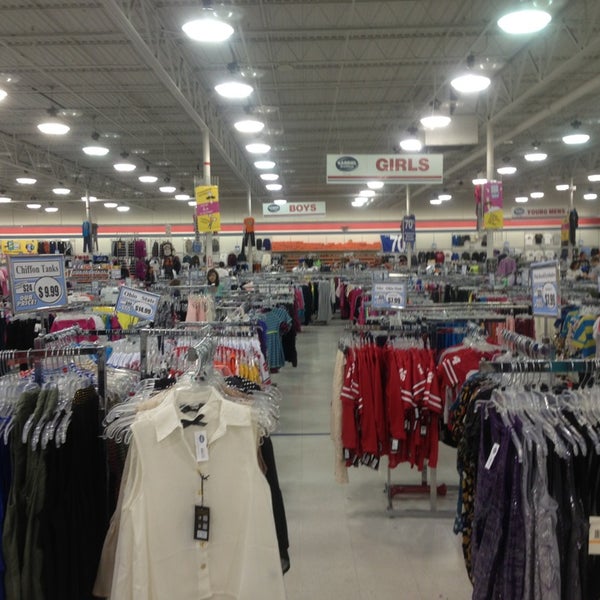
You are a GUI agent. You are given a task and a screenshot of the screen. Output one action in this format:
    pyautogui.click(x=<x>, y=<y>)
    Task: Click on the tiled white floor
    The height and width of the screenshot is (600, 600).
    Given the screenshot: What is the action you would take?
    pyautogui.click(x=342, y=542), pyautogui.click(x=316, y=412)